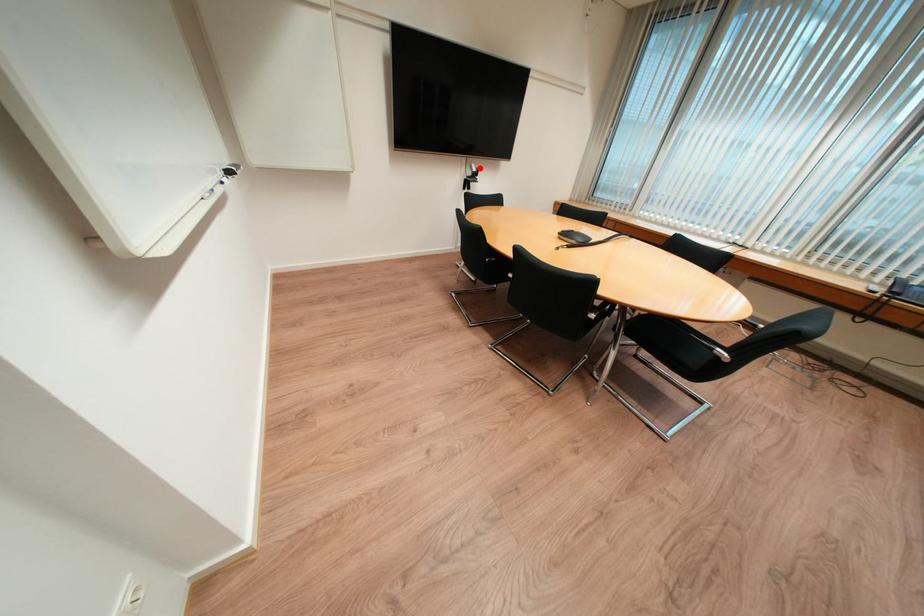
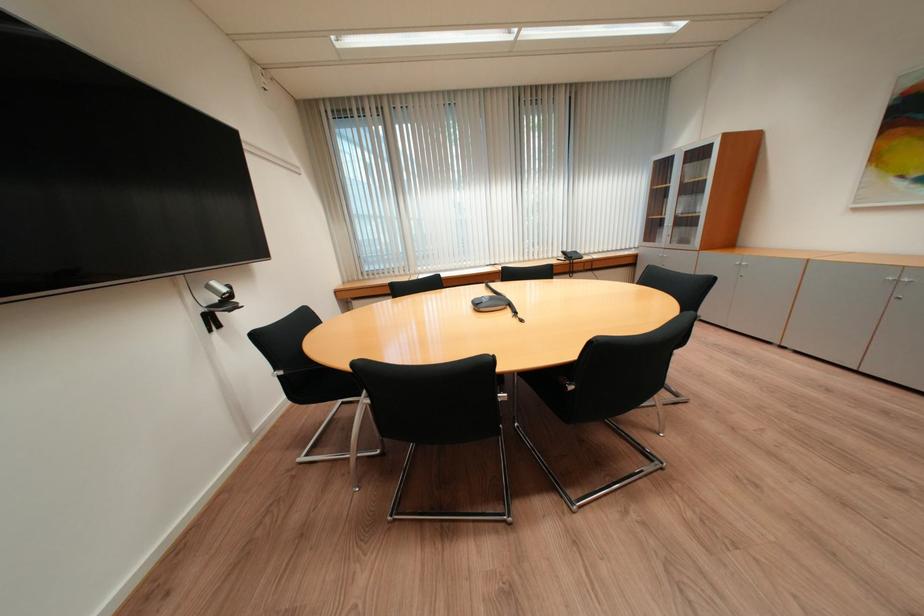
Question: I am providing you with two images of the same scene from different viewpoints. A red point is shown in image1. For the corresponding object point in image2, is it positioned nearer or farther from the camera?

Choices:
 (A) Nearer
 (B) Farther

Answer: (B)